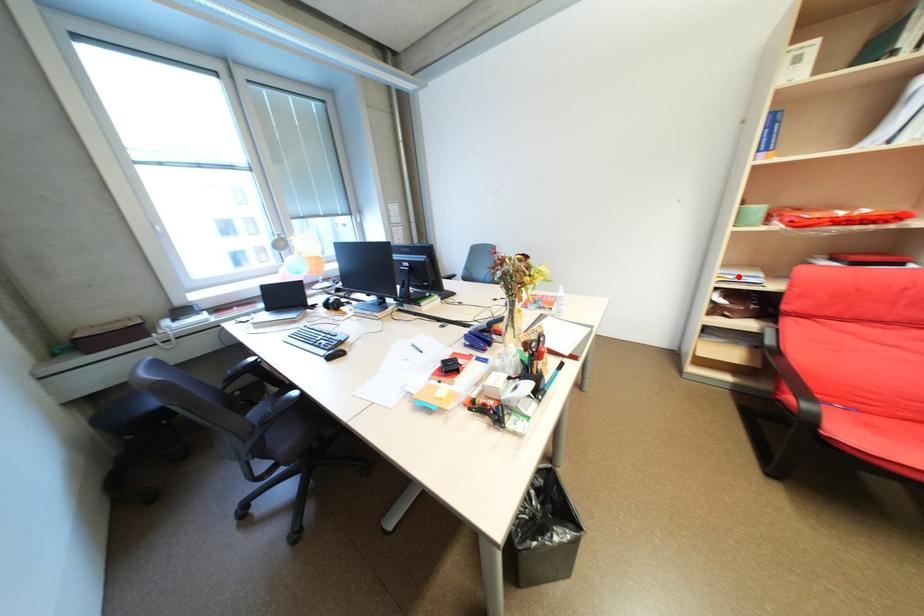
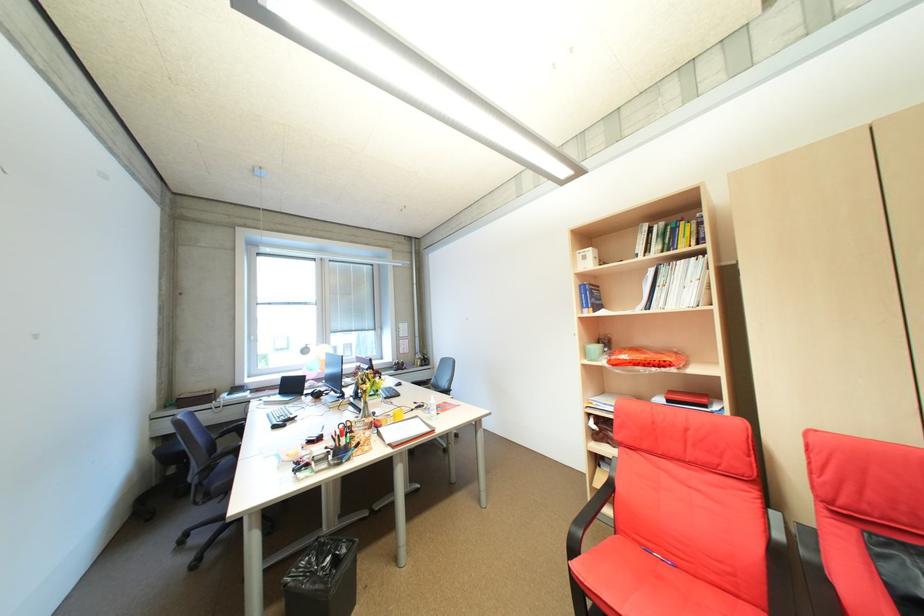
Question: A red point is marked in image1. In image2, is the corresponding 3D point closer to the camera or farther? Reply with the corresponding letter.

Choices:
 (A) The corresponding 3D point is closer.
 (B) The corresponding 3D point is farther.

Answer: (B)